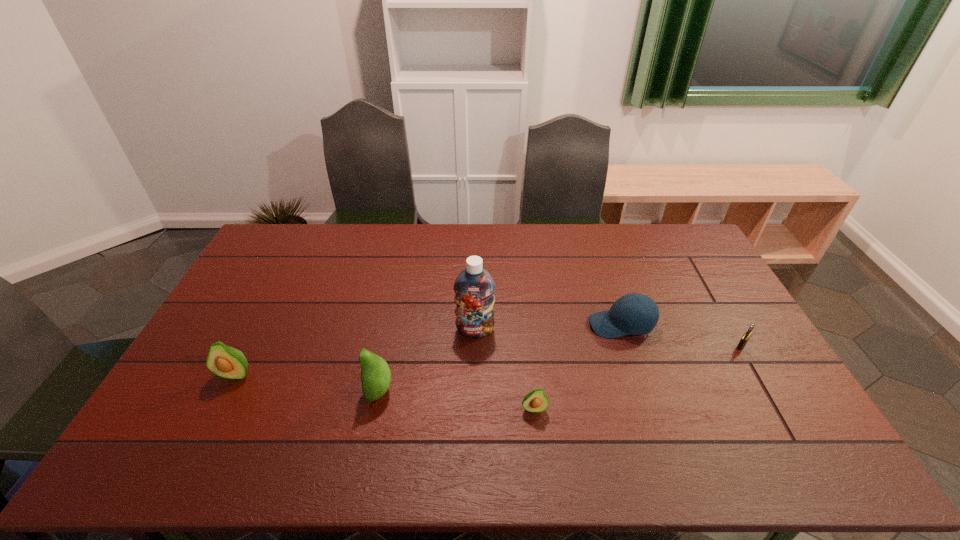
The width and height of the screenshot is (960, 540). In order to click on vacant space located 0.060m on the cut side of the second tallest avocado in this screenshot , I will do `click(221, 403)`.

Where is `vacant point located on the cut side of the second avocado from right to left`? The image size is (960, 540). vacant point located on the cut side of the second avocado from right to left is located at coordinates (218, 390).

The width and height of the screenshot is (960, 540). I want to click on vacant space located 0.140m on the cut side of the second avocado from right to left, so click(314, 390).

You are a GUI agent. You are given a task and a screenshot of the screen. Output one action in this format:
    pyautogui.click(x=<x>, y=<y>)
    Task: Click on the free region located 0.140m on the cut side of the second avocado from right to left
    The image size is (960, 540).
    Given the screenshot: What is the action you would take?
    pyautogui.click(x=314, y=390)

Locate an element on the screen. free space located 0.070m on the back of the fourth nearest object is located at coordinates (729, 323).

This screenshot has height=540, width=960. I want to click on free space located 0.380m on the front-facing side of the fifth object from left to right, so click(x=467, y=325).

Locate an element on the screen. free space located on the front-facing side of the fifth object from left to right is located at coordinates (467, 325).

Identify the location of free point located on the front-facing side of the fifth object from left to right. Image resolution: width=960 pixels, height=540 pixels. (473, 325).

Where is `free region located 0.150m on the front label of the shampoo`? free region located 0.150m on the front label of the shampoo is located at coordinates (474, 380).

Find the location of a particular element. object located at the left edge is located at coordinates (225, 361).